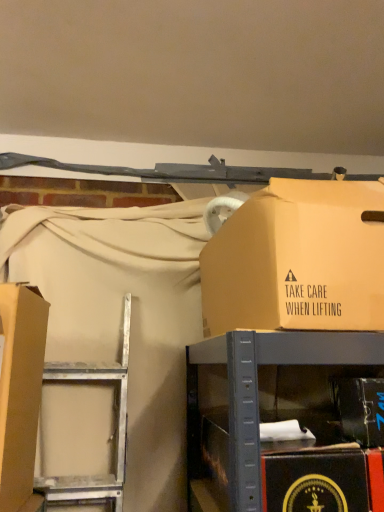
Image resolution: width=384 pixels, height=512 pixels. What do you see at coordinates (298, 260) in the screenshot? I see `matte cardboard box at upper right, the 2th box viewed from the right` at bounding box center [298, 260].

What do you see at coordinates (361, 409) in the screenshot?
I see `metallic black box at lower right, arranged as the third box when viewed from the left` at bounding box center [361, 409].

Describe the element at coordinates (283, 419) in the screenshot. I see `metallic cardboard box at center` at that location.

Find the location of `matte cardboard box at upper right, arranged as the second box when viewed from the left`. matte cardboard box at upper right, arranged as the second box when viewed from the left is located at coordinates (298, 260).

Is matte cardboard box at upper right, the 2th box viewed from the right, closer to camera compared to metallic cardboard box at center?

No, it is not.

Can you tell me how much matte cardboard box at upper right, the 2th box viewed from the right, and metallic cardboard box at center differ in facing direction?

There is a 1.49-degree angle between the facing directions of matte cardboard box at upper right, the 2th box viewed from the right, and metallic cardboard box at center.

Is matte cardboard box at upper right, arranged as the second box when viewed from the left, turned away from metallic cardboard box at center?

No.

From the image's perspective, which one is positioned higher, matte cardboard box at upper right, the 2th box viewed from the right, or metallic cardboard box at center?

matte cardboard box at upper right, the 2th box viewed from the right.

Based on their sizes in the image, would you say matte cardboard box at left, arranged as the 3th box when viewed from the right, is bigger or smaller than metallic cardboard box at center?

In the image, matte cardboard box at left, arranged as the 3th box when viewed from the right, appears to be smaller than metallic cardboard box at center.

Are matte cardboard box at left, acting as the first box starting from the left, and metallic cardboard box at center beside each other?

No, matte cardboard box at left, acting as the first box starting from the left, is not next to metallic cardboard box at center.

Considering the sizes of objects matte cardboard box at left, arranged as the 3th box when viewed from the right, and metallic cardboard box at center in the image provided, who is wider, matte cardboard box at left, arranged as the 3th box when viewed from the right, or metallic cardboard box at center?

metallic cardboard box at center is wider.

From the image's perspective, is metallic cardboard box at center beneath matte cardboard box at left, acting as the first box starting from the left?

Correct, metallic cardboard box at center appears lower than matte cardboard box at left, acting as the first box starting from the left, in the image.

From a real-world perspective, which box is the 2nd one above the metallic cardboard box at center? Please provide its 2D coordinates.

[(20, 392)]

How many degrees apart are the facing directions of metallic cardboard box at center and matte cardboard box at left, arranged as the 3th box when viewed from the right?

89 degrees separate the facing orientations of metallic cardboard box at center and matte cardboard box at left, arranged as the 3th box when viewed from the right.

Based on the photo, would you say metallic cardboard box at center is inside or outside matte cardboard box at left, arranged as the 3th box when viewed from the right?

metallic cardboard box at center is spatially situated outside matte cardboard box at left, arranged as the 3th box when viewed from the right.

This screenshot has height=512, width=384. I want to click on box above the matte cardboard box at left, arranged as the 3th box when viewed from the right (from a real-world perspective), so click(298, 260).

Is matte cardboard box at upper right, arranged as the second box when viewed from the left, with matte cardboard box at left, arranged as the 3th box when viewed from the right?

No, matte cardboard box at upper right, arranged as the second box when viewed from the left, is not next to matte cardboard box at left, arranged as the 3th box when viewed from the right.

Is matte cardboard box at upper right, arranged as the second box when viewed from the left, facing towards matte cardboard box at left, arranged as the 3th box when viewed from the right?

No, matte cardboard box at upper right, arranged as the second box when viewed from the left, does not turn towards matte cardboard box at left, arranged as the 3th box when viewed from the right.

From the image's perspective, relative to matte cardboard box at left, acting as the first box starting from the left, is matte cardboard box at upper right, arranged as the second box when viewed from the left, above or below?

matte cardboard box at upper right, arranged as the second box when viewed from the left, is situated higher than matte cardboard box at left, acting as the first box starting from the left, in the image.

How far apart are matte cardboard box at upper right, arranged as the second box when viewed from the left, and metallic black box at lower right, the 1th box positioned from the right?

matte cardboard box at upper right, arranged as the second box when viewed from the left, and metallic black box at lower right, the 1th box positioned from the right, are 9.57 inches apart from each other.

From their relative heights in the image, would you say matte cardboard box at upper right, the 2th box viewed from the right, is taller or shorter than metallic black box at lower right, the 1th box positioned from the right?

Considering their sizes, matte cardboard box at upper right, the 2th box viewed from the right, has more height than metallic black box at lower right, the 1th box positioned from the right.

Which is behind, point (268, 256) or point (367, 443)?

Point (268, 256)

From a real-world perspective, which is physically below, matte cardboard box at upper right, arranged as the second box when viewed from the left, or metallic black box at lower right, the 1th box positioned from the right?

metallic black box at lower right, the 1th box positioned from the right.

From a real-world perspective, between matte cardboard box at left, acting as the first box starting from the left, and metallic black box at lower right, arranged as the third box when viewed from the left, who is vertically higher?

From a 3D spatial view, matte cardboard box at left, acting as the first box starting from the left, is above.

Considering the relative sizes of matte cardboard box at left, acting as the first box starting from the left, and metallic black box at lower right, the 1th box positioned from the right, in the image provided, is matte cardboard box at left, acting as the first box starting from the left, smaller than metallic black box at lower right, the 1th box positioned from the right,?

Actually, matte cardboard box at left, acting as the first box starting from the left, might be larger than metallic black box at lower right, the 1th box positioned from the right.

Would you consider matte cardboard box at left, acting as the first box starting from the left, to be distant from metallic black box at lower right, arranged as the third box when viewed from the left?

No, matte cardboard box at left, acting as the first box starting from the left, is in close proximity to metallic black box at lower right, arranged as the third box when viewed from the left.

From a real-world perspective, is metallic cardboard box at center physically above metallic black box at lower right, arranged as the third box when viewed from the left?

No, from a real-world perspective, metallic cardboard box at center is not over metallic black box at lower right, arranged as the third box when viewed from the left

Between metallic cardboard box at center and metallic black box at lower right, arranged as the third box when viewed from the left, which one is positioned in front?

metallic cardboard box at center is closer to the camera.

From the picture: Considering the relative positions of metallic cardboard box at center and metallic black box at lower right, the 1th box positioned from the right, in the image provided, is metallic cardboard box at center to the left of metallic black box at lower right, the 1th box positioned from the right, from the viewer's perspective?

Yes.

Is metallic cardboard box at center positioned with its back to metallic black box at lower right, the 1th box positioned from the right?

No, metallic cardboard box at center's orientation is not away from metallic black box at lower right, the 1th box positioned from the right.

Find the location of a particular element. The width and height of the screenshot is (384, 512). furniture located underneath the matte cardboard box at upper right, the 2th box viewed from the right (from a real-world perspective) is located at coordinates (283, 419).

What are the coordinates of `furniture on the right of matte cardboard box at left, arranged as the 3th box when viewed from the right` in the screenshot? It's located at (283, 419).

Which object lies further to the anchor point metallic cardboard box at center, metallic black box at lower right, the 1th box positioned from the right, or matte cardboard box at left, acting as the first box starting from the left?

matte cardboard box at left, acting as the first box starting from the left.

Based on their spatial positions, is metallic cardboard box at center or matte cardboard box at upper right, arranged as the second box when viewed from the left, closer to metallic black box at lower right, arranged as the third box when viewed from the left?

metallic cardboard box at center is closer to metallic black box at lower right, arranged as the third box when viewed from the left.

Which object lies further to the anchor point matte cardboard box at left, arranged as the 3th box when viewed from the right, matte cardboard box at upper right, arranged as the second box when viewed from the left, or metallic cardboard box at center?

matte cardboard box at upper right, arranged as the second box when viewed from the left, lies further to matte cardboard box at left, arranged as the 3th box when viewed from the right, than the other object.

Considering their positions, is matte cardboard box at left, acting as the first box starting from the left, positioned further to matte cardboard box at upper right, the 2th box viewed from the right, than metallic cardboard box at center?

Based on the image, matte cardboard box at left, acting as the first box starting from the left, appears to be further to matte cardboard box at upper right, the 2th box viewed from the right.

When comparing their distances from metallic black box at lower right, the 1th box positioned from the right, does matte cardboard box at upper right, the 2th box viewed from the right, or metallic cardboard box at center seem further?

Among the two, matte cardboard box at upper right, the 2th box viewed from the right, is located further to metallic black box at lower right, the 1th box positioned from the right.

Based on their spatial positions, is metallic black box at lower right, arranged as the third box when viewed from the left, or metallic cardboard box at center closer to matte cardboard box at left, arranged as the 3th box when viewed from the right?

Result: metallic cardboard box at center.

When comparing their distances from matte cardboard box at left, acting as the first box starting from the left, does metallic black box at lower right, arranged as the third box when viewed from the left, or matte cardboard box at upper right, the 2th box viewed from the right, seem further?

metallic black box at lower right, arranged as the third box when viewed from the left, lies further to matte cardboard box at left, acting as the first box starting from the left, than the other object.

Looking at this image, looking at the image, which one is located closer to metallic black box at lower right, arranged as the third box when viewed from the left, matte cardboard box at left, acting as the first box starting from the left, or matte cardboard box at upper right, arranged as the second box when viewed from the left?

matte cardboard box at upper right, arranged as the second box when viewed from the left.

Where is `furniture located between matte cardboard box at left, acting as the first box starting from the left, and matte cardboard box at upper right, arranged as the second box when viewed from the left, in the left-right direction`? This screenshot has height=512, width=384. furniture located between matte cardboard box at left, acting as the first box starting from the left, and matte cardboard box at upper right, arranged as the second box when viewed from the left, in the left-right direction is located at coordinates [283, 419].

This screenshot has width=384, height=512. I want to click on box situated between matte cardboard box at left, arranged as the 3th box when viewed from the right, and metallic black box at lower right, arranged as the third box when viewed from the left, from left to right, so click(298, 260).

The image size is (384, 512). Find the location of `furniture located between matte cardboard box at left, acting as the first box starting from the left, and metallic black box at lower right, the 1th box positioned from the right, in the left-right direction`. furniture located between matte cardboard box at left, acting as the first box starting from the left, and metallic black box at lower right, the 1th box positioned from the right, in the left-right direction is located at coordinates (283, 419).